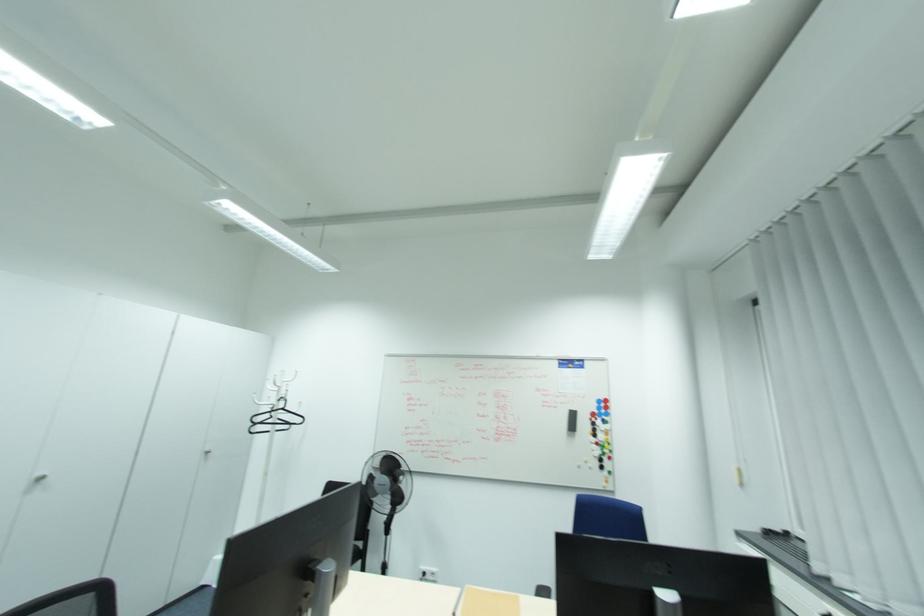
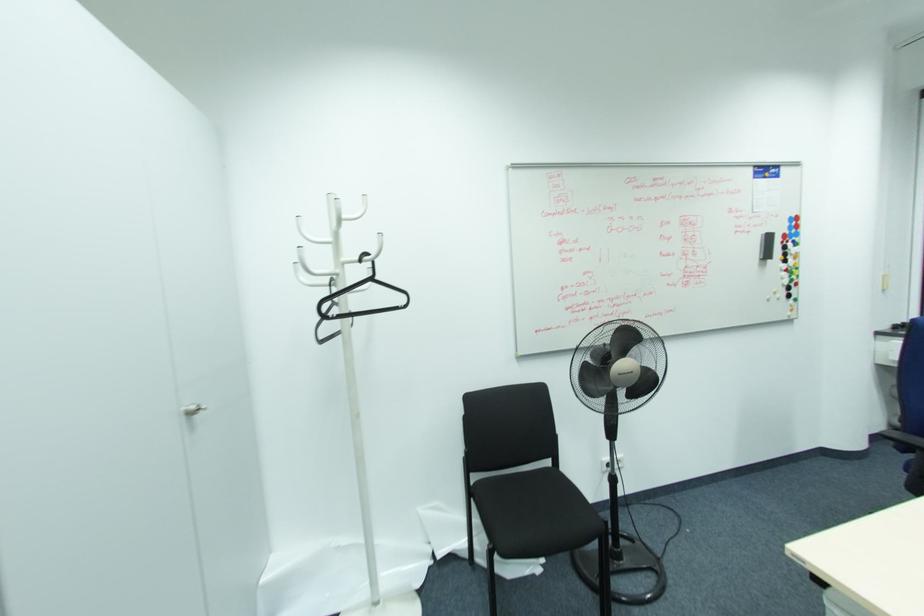
Question: I am providing you with two images of the same scene from different viewpoints. Please identify which objects are invisible in image2.

Choices:
 (A) black whiteboard eraser
 (B) black clothes hanger
 (C) black chair sitting surface
 (D) none of these

Answer: (D)